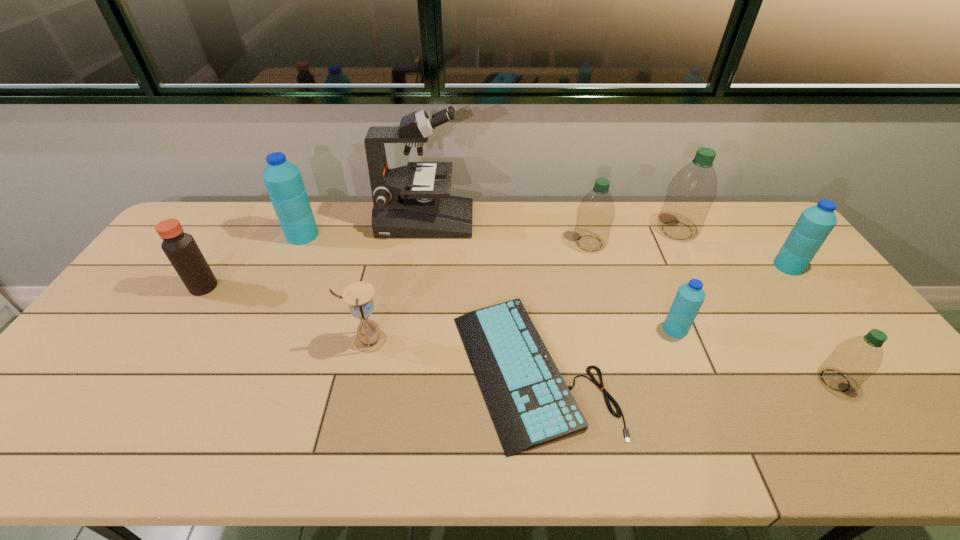
At what (x,y) coordinates should I click in order to perform the action: click on the second closest green water bottle relative to the nearest blue water bottle. Please return your answer as a coordinate pair (x, y). The height and width of the screenshot is (540, 960). Looking at the image, I should click on (596, 212).

Select which blue water bottle appears as the second closest to the farthest blue water bottle. Please provide its 2D coordinates. Your answer should be formatted as a tuple, i.e. [(x, y)], where the tuple contains the x and y coordinates of a point satisfying the conditions above.

[(815, 223)]

Select which blue water bottle appears as the closest to the eighth object from left to right. Please provide its 2D coordinates. Your answer should be formatted as a tuple, i.e. [(x, y)], where the tuple contains the x and y coordinates of a point satisfying the conditions above.

[(815, 223)]

The width and height of the screenshot is (960, 540). In order to click on free space that satisfies the following two spatial constraints: 1. through the eyepieces of the microscope; 2. on the back side of the nearest blue water bottle in this screenshot , I will do click(410, 329).

Identify the location of vacant space that satisfies the following two spatial constraints: 1. through the eyepieces of the tallest object; 2. on the right side of the eighth object from left to right. This screenshot has height=540, width=960. (424, 230).